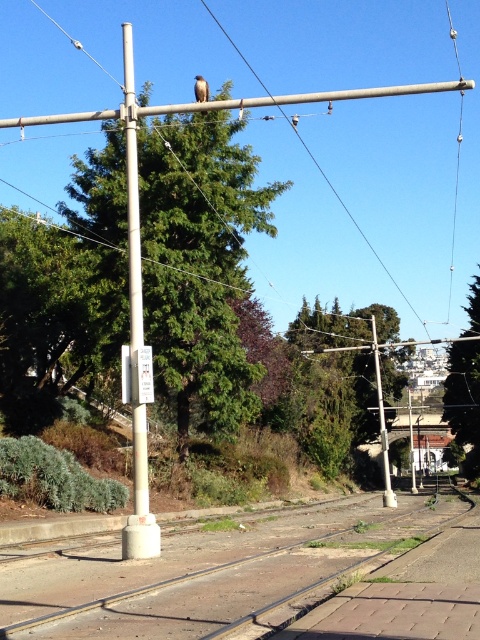
Question: Which is nearer to the smooth concrete train track at center?

Choices:
 (A) brushed metal pole at center
 (B) white plastic sign at center-left
 (C) smooth metallic pole at center

Answer: (B)

Question: Estimate the real-world distances between objects in this image. Which object is closer to the metallic pole at upper center?

Choices:
 (A) green textured tree at upper center
 (B) green leafy tree at center
 (C) smooth concrete train track at center
 (D) white concrete pole at center

Answer: (B)

Question: Does green textured tree at upper center have a smaller size compared to white concrete pole at center?

Choices:
 (A) no
 (B) yes

Answer: (A)

Question: Which is farther from the green textured tree at upper center?

Choices:
 (A) metallic pole at upper center
 (B) brown feathered eagle at upper center
 (C) white concrete pole at center

Answer: (A)

Question: Is white concrete pole at center positioned behind brushed metal pole at center?

Choices:
 (A) no
 (B) yes

Answer: (A)

Question: Does smooth metallic pole at center appear over brushed metal pole at center?

Choices:
 (A) yes
 (B) no

Answer: (A)